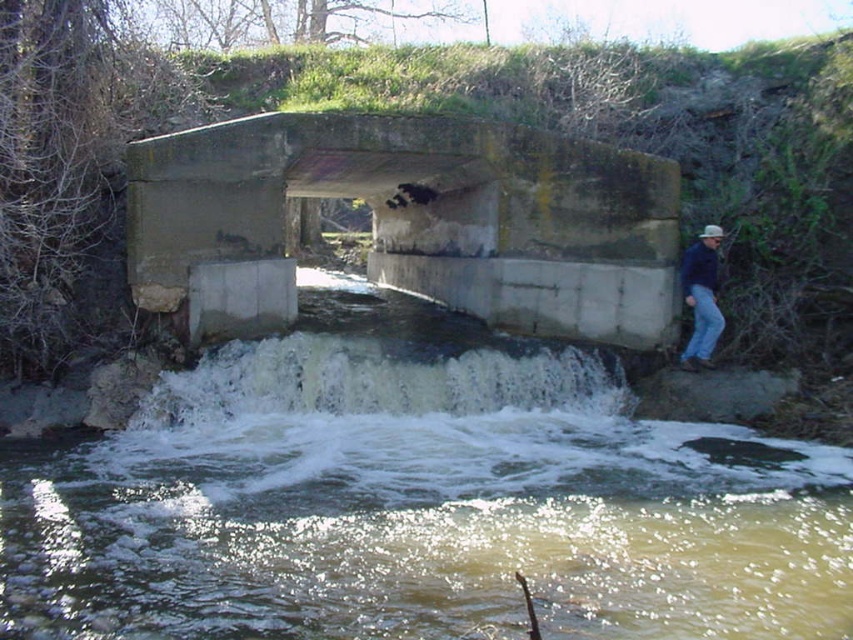
Question: Which point appears farthest from the camera in this image?

Choices:
 (A) (709, 244)
 (B) (57, 604)
 (C) (502, 356)

Answer: (A)

Question: Which point is farther to the camera?

Choices:
 (A) concrete bridge at center
 (B) brown concrete waterfall at center
 (C) blue jeans at right

Answer: (A)

Question: Is white frothy water at center closer to the viewer compared to blue jeans at right?

Choices:
 (A) no
 (B) yes

Answer: (B)

Question: Does brown concrete waterfall at center have a smaller size compared to white frothy water at center?

Choices:
 (A) no
 (B) yes

Answer: (A)

Question: Which object appears farthest from the camera in this image?

Choices:
 (A) concrete bridge at center
 (B) brown concrete waterfall at center
 (C) white frothy water at center

Answer: (A)

Question: Is brown concrete waterfall at center further to camera compared to blue jeans at right?

Choices:
 (A) yes
 (B) no

Answer: (B)